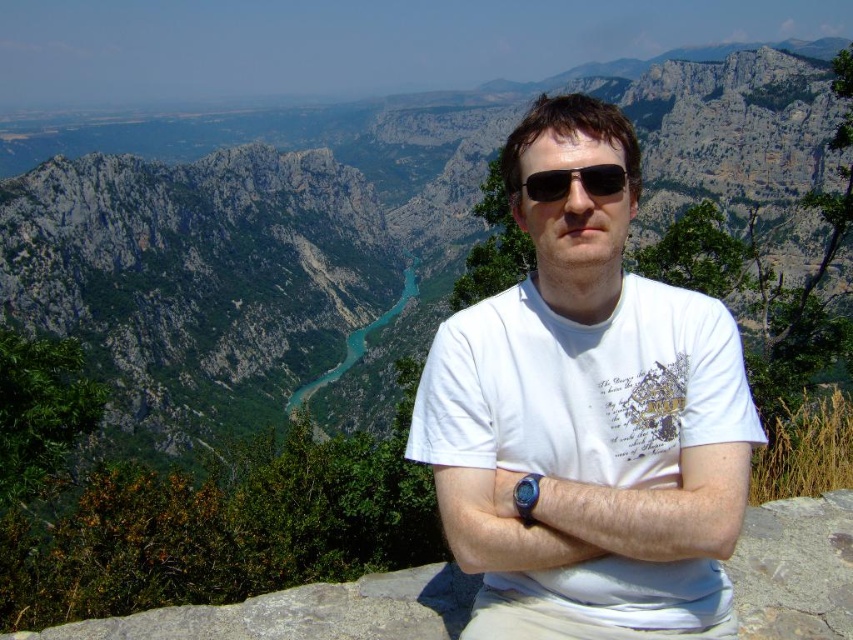
You are standing at the point where the person is located in the image. You want to throw a rock to the point marked as point (352,380). Can you estimate how far you need to throw the rock?

The distance of point (352,380) from camera is 150.14 meters, so you need to throw the rock approximately 150.14 meters.

You are a photographer trying to capture the gray rocky mountain at center and the black plastic sunglasses at center in a single frame. Based on their positions, which object appears closer to the camera?

The black plastic sunglasses at center appears closer to the camera because the gray rocky mountain at center is positioned over it, indicating it is farther away.